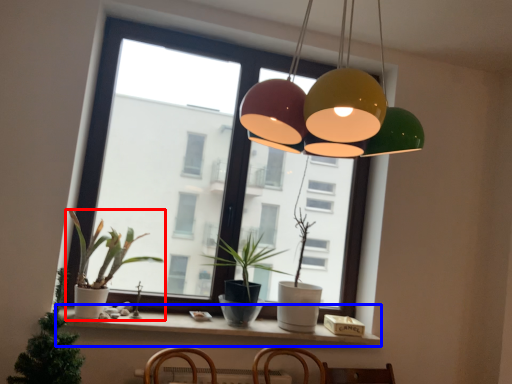
Question: Which object appears farthest to the camera in this image, houseplant (highlighted by a red box) or window sill (highlighted by a blue box)?

Choices:
 (A) houseplant
 (B) window sill

Answer: (B)